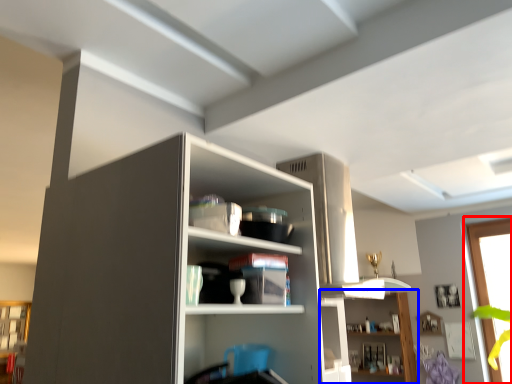
Question: Among these objects, which one is nearest to the camera, window (highlighted by a red box) or shelf (highlighted by a blue box)?

Choices:
 (A) window
 (B) shelf

Answer: (A)